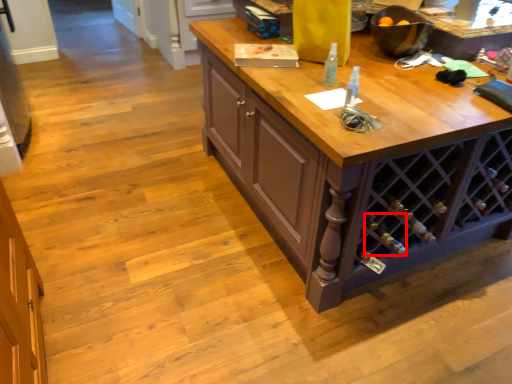
Question: From the image's perspective, where is wine bottle (annotated by the red box) located relative to bottle?

Choices:
 (A) below
 (B) above

Answer: (A)